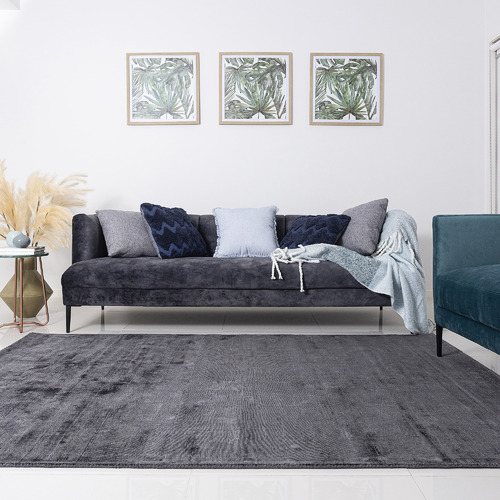
Find the location of a particular element. rug is located at coordinates (157, 367).